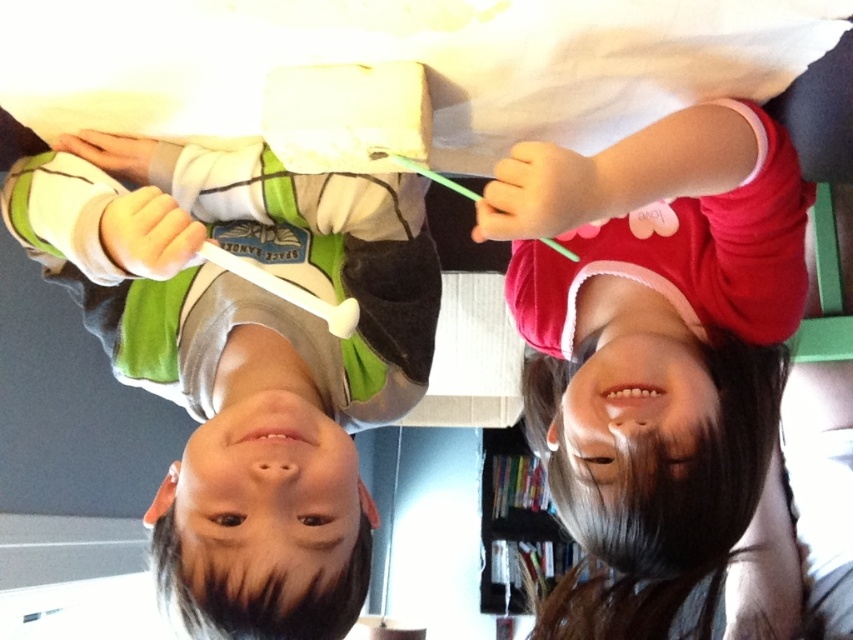
You are a photographer who needs to adjust the lighting for a photo shoot. You notice two children in the image wearing a matte green and white shirt at left and a matte pink hoodie at upper right. Based on their positions, which child is standing closer to the left side of the frame?

The matte green and white shirt at left is positioned on the left side of matte pink hoodie at upper right, so the child wearing the matte green and white shirt at left is closer to the left side of the frame.